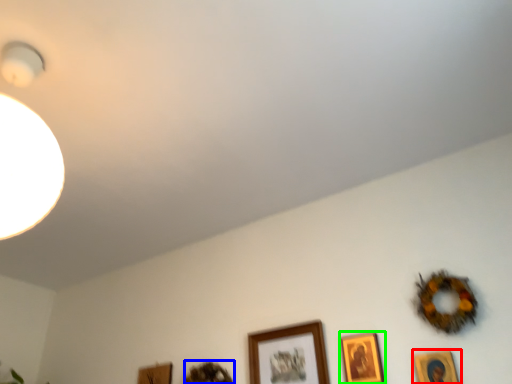
Question: Which is nearer to the picture frame (highlighted by a red box)? picture frame (highlighted by a blue box) or picture frame (highlighted by a green box).

Choices:
 (A) picture frame
 (B) picture frame

Answer: (B)